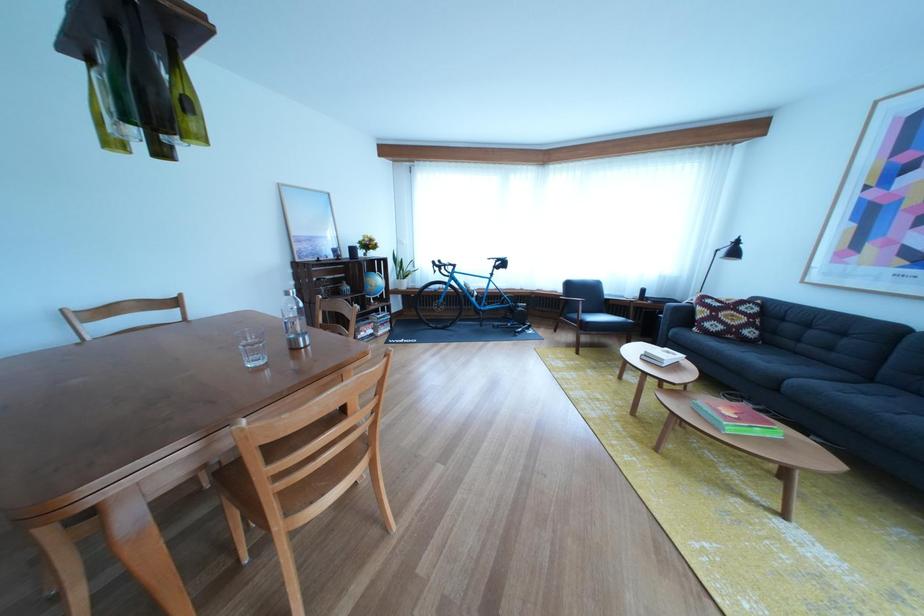
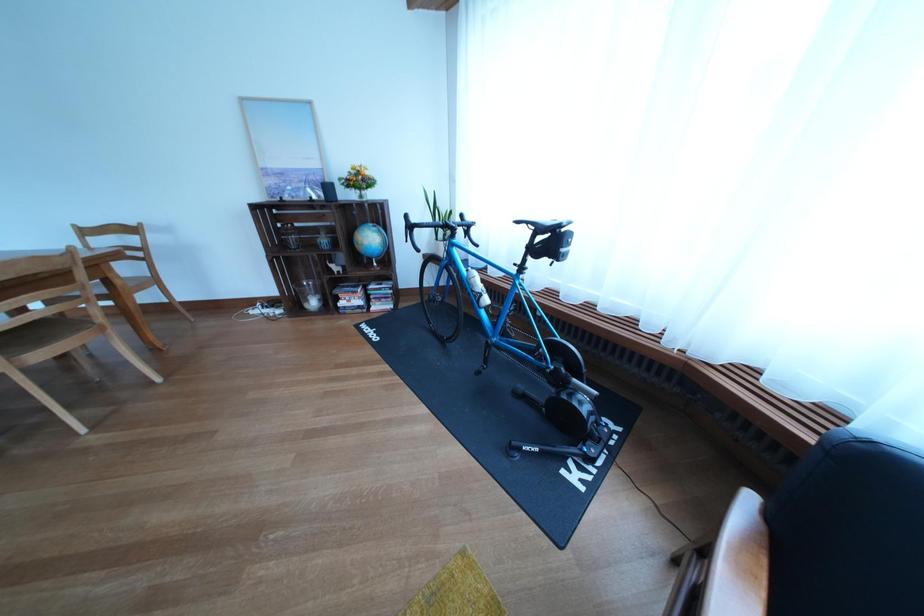
Locate, in the second image, the point that corresponds to [391,286] in the first image.

(383, 244)